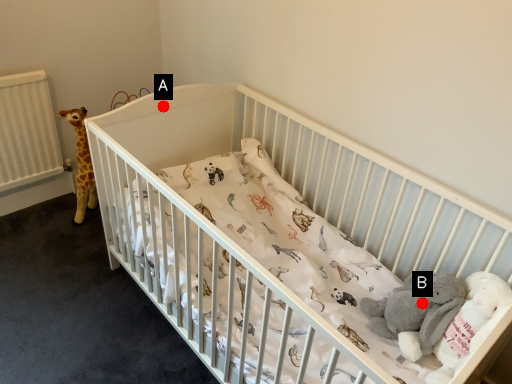
Question: Two points are circled on the image, labeled by A and B beside each circle. Which point is further to the camera?

Choices:
 (A) A is further
 (B) B is further

Answer: (A)